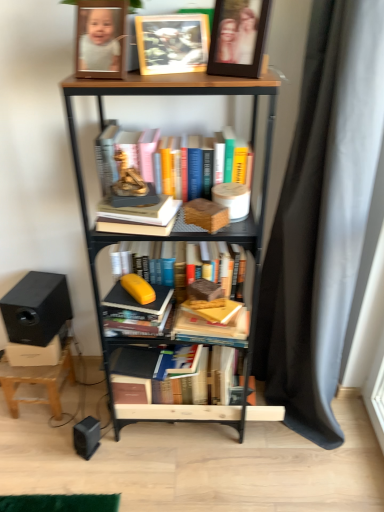
Question: Should I look upward or downward to see black plastic speaker at lower left, the first speaker in the right-to-left sequence?

Choices:
 (A) down
 (B) up

Answer: (A)

Question: Does wooden stool at lower left come in front of black fabric curtain at right?

Choices:
 (A) no
 (B) yes

Answer: (A)

Question: From the image's perspective, does wooden stool at lower left appear lower than black fabric curtain at right?

Choices:
 (A) no
 (B) yes

Answer: (B)

Question: Considering the relative sizes of wooden stool at lower left and black fabric curtain at right in the image provided, is wooden stool at lower left thinner than black fabric curtain at right?

Choices:
 (A) no
 (B) yes

Answer: (B)

Question: Considering the relative positions of wooden stool at lower left and black fabric curtain at right in the image provided, is wooden stool at lower left behind black fabric curtain at right?

Choices:
 (A) yes
 (B) no

Answer: (A)

Question: Is wooden stool at lower left turned away from black fabric curtain at right?

Choices:
 (A) yes
 (B) no

Answer: (B)

Question: Is wooden stool at lower left not within black fabric curtain at right?

Choices:
 (A) no
 (B) yes

Answer: (B)

Question: Are wooden photo frame at upper center, the 2th picture frame from the right, and wooden paperback book at center located far from each other?

Choices:
 (A) yes
 (B) no

Answer: (B)

Question: From a real-world perspective, is wooden photo frame at upper center, the 2th picture frame from the right, positioned under wooden paperback book at center based on gravity?

Choices:
 (A) no
 (B) yes

Answer: (A)

Question: Is wooden photo frame at upper center, the 2th picture frame from the right, shorter than wooden paperback book at center?

Choices:
 (A) no
 (B) yes

Answer: (A)

Question: Is wooden photo frame at upper center, the 2th picture frame from the right, at the right side of wooden paperback book at center?

Choices:
 (A) yes
 (B) no

Answer: (B)

Question: From a real-world perspective, is wooden photo frame at upper center, positioned as the 1th picture frame in left-to-right order, on wooden paperback book at center?

Choices:
 (A) no
 (B) yes

Answer: (B)

Question: Is wooden photo frame at upper center, positioned as the 1th picture frame in left-to-right order, aimed at wooden paperback book at center?

Choices:
 (A) yes
 (B) no

Answer: (B)

Question: Is wooden bookcase at center positioned with its back to hardcover book at center, the 3th book ordered from the bottom?

Choices:
 (A) yes
 (B) no

Answer: (A)